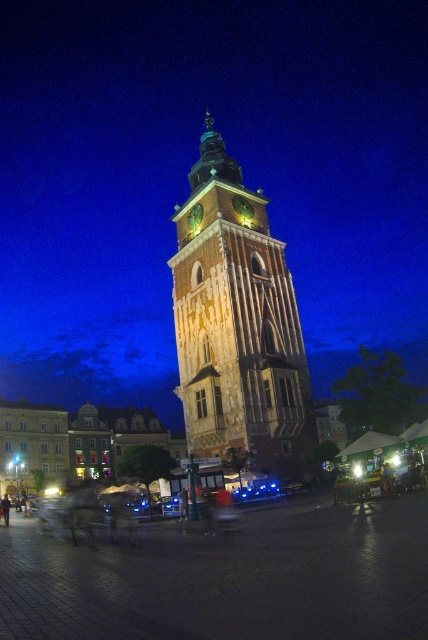
You are standing in the cobblestone plaza and want to take a photo of the stone clock tower at center. If you move 0.3 units to the north, will the tower still be in your camera frame?

The stone clock tower at center is located at point (237, 326). Moving 0.3 units north might take you out of the frame depending on camera angle and zoom, but since the tower is centrally positioned, it likely remains visible unless the shift is drastic.

You are a tourist standing in the cobblestone plaza in front of the clock tower. You notice two clocks in the scene. The first is the stone clock tower at center, and the second is the green stone clock at center. Which clock is positioned higher in the image?

The stone clock tower at center is positioned higher than the green stone clock at center.